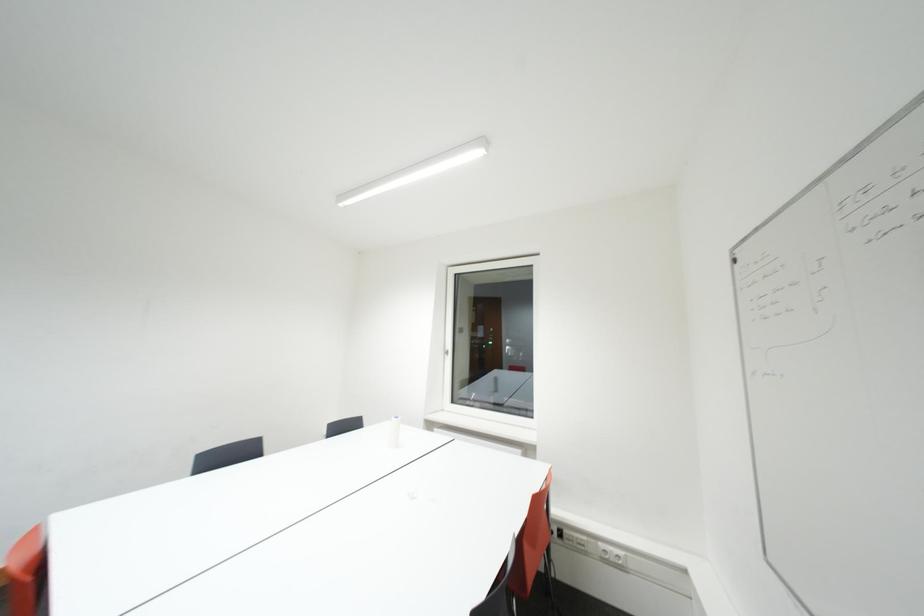
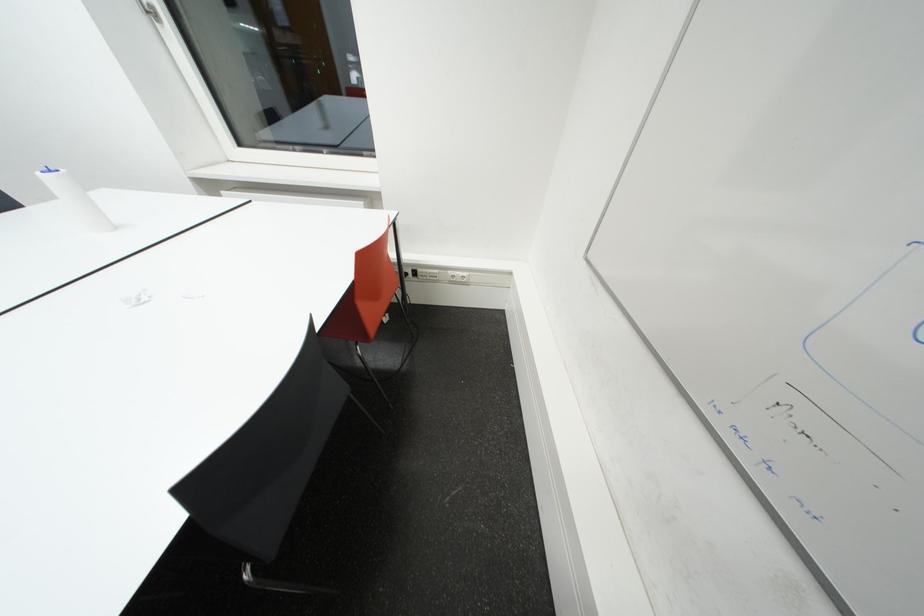
Based on the continuous images, in which direction is the camera rotating?

The rotation direction of the camera is right-down.